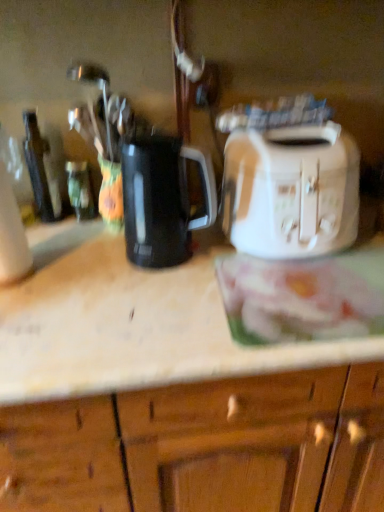
This screenshot has width=384, height=512. Find the location of `free space in front of black plastic kettle at center`. free space in front of black plastic kettle at center is located at coordinates (163, 305).